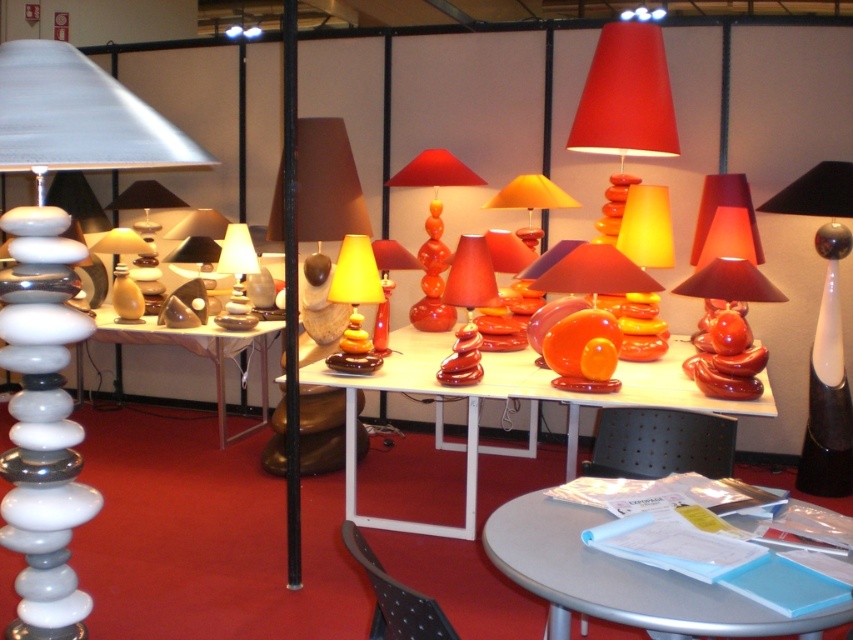
Question: Which of the following is the closest to the observer?

Choices:
 (A) (119, 230)
 (B) (677, 403)
 (C) (245, 332)
 (D) (45, 74)

Answer: (D)

Question: Is black textured chair at lower center positioned in front of yellow matte lampshade at center?

Choices:
 (A) no
 (B) yes

Answer: (B)

Question: Which is farther from the translucent orange glass lampshade at center?

Choices:
 (A) white glossy stacked stones at left
 (B) matte white lampshade at center
 (C) shiny metallic lampshade at center
 (D) glossy orange glass table lamp at center

Answer: (A)

Question: Is glossy orange glass table lamp at center positioned behind white glossy table at center?

Choices:
 (A) yes
 (B) no

Answer: (B)

Question: Which is nearer to the white glossy table at center?

Choices:
 (A) matte orange glass table lamp at center
 (B) matte white lampshade at center

Answer: (B)

Question: Is metallic gray table at center thinner than matte white lampshade at center?

Choices:
 (A) no
 (B) yes

Answer: (A)